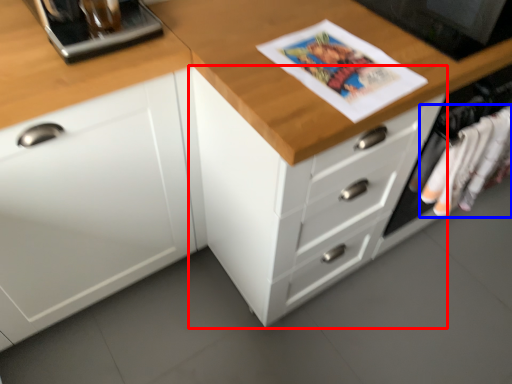
Question: Which of the following is the farthest to the observer, chest of drawers (highlighted by a red box) or clothing (highlighted by a blue box)?

Choices:
 (A) chest of drawers
 (B) clothing

Answer: (B)